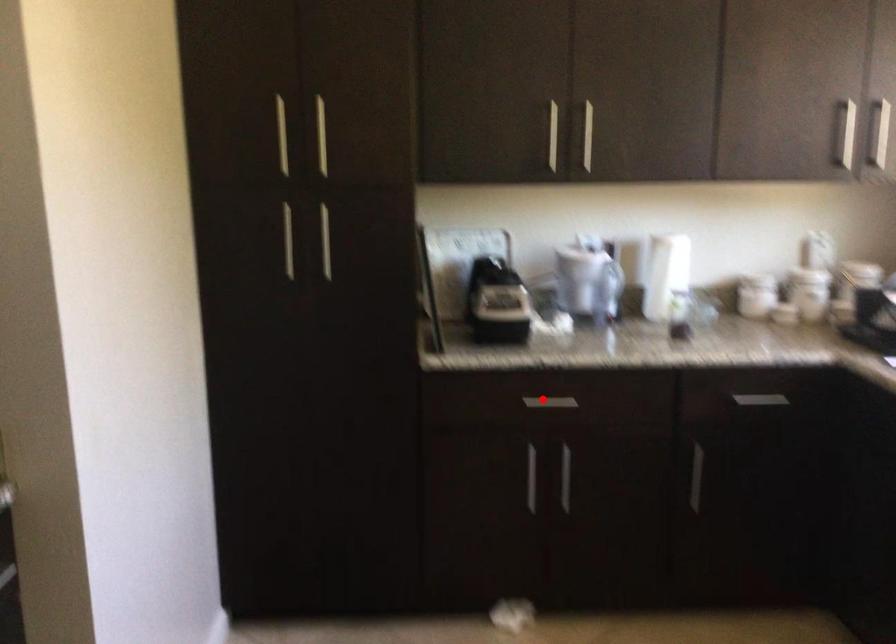
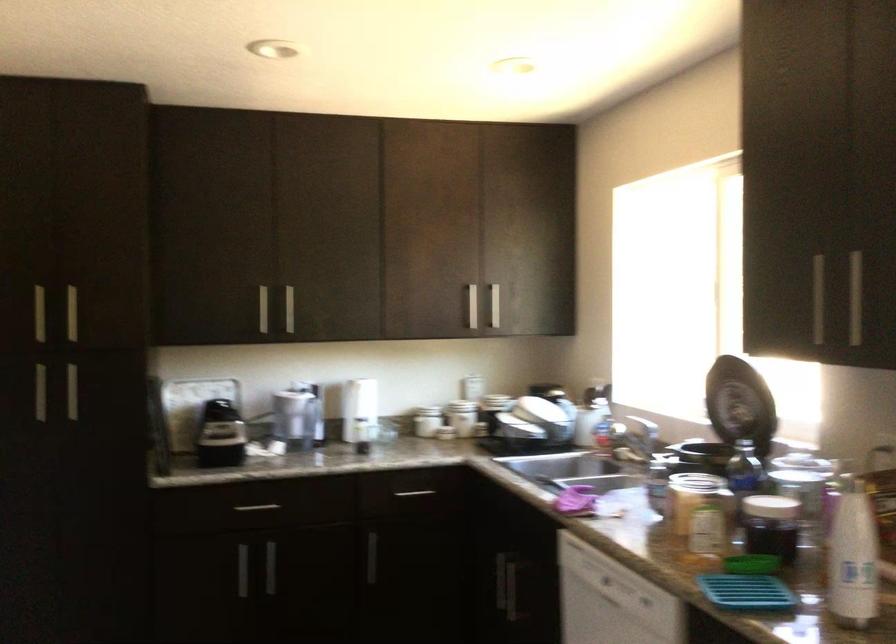
Question: A red point is marked in image1. In image2, is the corresponding 3D point closer to the camera or farther? Reply with the corresponding letter.

Choices:
 (A) The corresponding 3D point is closer.
 (B) The corresponding 3D point is farther.

Answer: (B)